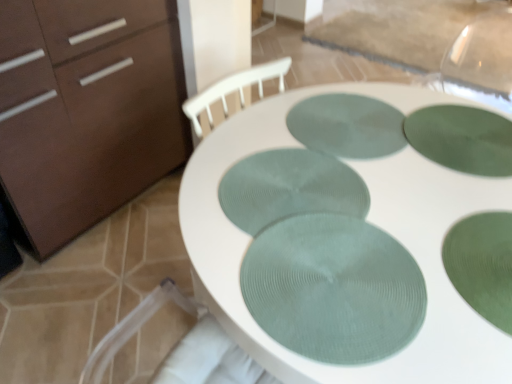
You are a GUI agent. You are given a task and a screenshot of the screen. Output one action in this format:
    pyautogui.click(x=<x>, y=<y>)
    Task: Click on the free region under green textured glass plate at upper right, placed as the 2th glass plate when sorted from back to front (from a real-world perspective)
    
    Given the screenshot: What is the action you would take?
    pyautogui.click(x=462, y=145)